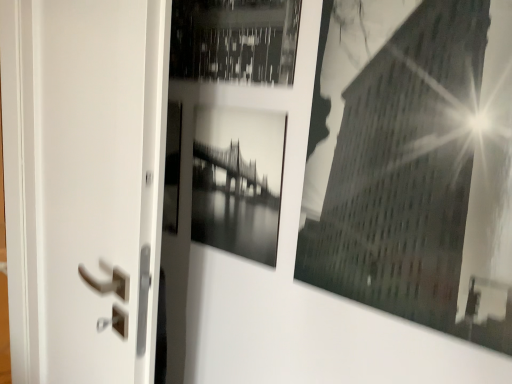
Question: Does black glossy photo frame at center, which appears as the second picture frame when viewed from the right, have a larger size compared to white matte screen door at left?

Choices:
 (A) no
 (B) yes

Answer: (A)

Question: Considering the relative sizes of black glossy photo frame at center, arranged as the first picture frame when viewed from the left, and white matte screen door at left in the image provided, is black glossy photo frame at center, arranged as the first picture frame when viewed from the left, taller than white matte screen door at left?

Choices:
 (A) yes
 (B) no

Answer: (B)

Question: Is black glossy photo frame at center, arranged as the first picture frame when viewed from the left, in front of white matte screen door at left?

Choices:
 (A) yes
 (B) no

Answer: (B)

Question: From a real-world perspective, is black glossy photo frame at center, which appears as the second picture frame when viewed from the right, positioned over white matte screen door at left based on gravity?

Choices:
 (A) yes
 (B) no

Answer: (A)

Question: Considering the relative sizes of black glossy photo frame at center, which appears as the second picture frame when viewed from the right, and white matte screen door at left in the image provided, is black glossy photo frame at center, which appears as the second picture frame when viewed from the right, shorter than white matte screen door at left?

Choices:
 (A) no
 (B) yes

Answer: (B)

Question: Is black glossy photo frame at center, which appears as the second picture frame when viewed from the right, situated inside white matte screen door at left or outside?

Choices:
 (A) outside
 (B) inside

Answer: (A)

Question: Would you say black glossy photo frame at center, which appears as the second picture frame when viewed from the right, is to the left or to the right of white matte screen door at left in the picture?

Choices:
 (A) left
 (B) right

Answer: (B)

Question: Considering the positions of black glossy photo frame at center, which appears as the second picture frame when viewed from the right, and white matte screen door at left in the image, is black glossy photo frame at center, which appears as the second picture frame when viewed from the right, wider or thinner than white matte screen door at left?

Choices:
 (A) wide
 (B) thin

Answer: (B)

Question: From the image's perspective, is black glossy photo frame at center, which appears as the second picture frame when viewed from the right, above or below white matte screen door at left?

Choices:
 (A) below
 (B) above

Answer: (B)

Question: From the image's perspective, is black glossy photo frame at center, arranged as the first picture frame when viewed from the left, positioned above or below black glossy building at upper right, the 1th picture frame viewed from the right?

Choices:
 (A) below
 (B) above

Answer: (A)

Question: Considering the positions of black glossy photo frame at center, arranged as the first picture frame when viewed from the left, and black glossy building at upper right, the 1th picture frame viewed from the right, in the image, is black glossy photo frame at center, arranged as the first picture frame when viewed from the left, bigger or smaller than black glossy building at upper right, the 1th picture frame viewed from the right,?

Choices:
 (A) small
 (B) big

Answer: (A)

Question: Considering the positions of black glossy photo frame at center, which appears as the second picture frame when viewed from the right, and black glossy building at upper right, which ranks as the second picture frame in left-to-right order, in the image, is black glossy photo frame at center, which appears as the second picture frame when viewed from the right, taller or shorter than black glossy building at upper right, which ranks as the second picture frame in left-to-right order,?

Choices:
 (A) tall
 (B) short

Answer: (B)

Question: From a real-world perspective, is black glossy photo frame at center, arranged as the first picture frame when viewed from the left, above or below black glossy building at upper right, the 1th picture frame viewed from the right?

Choices:
 (A) below
 (B) above

Answer: (A)

Question: Considering the positions of white matte screen door at left and black glossy building at upper right, the 1th picture frame viewed from the right, in the image, is white matte screen door at left bigger or smaller than black glossy building at upper right, the 1th picture frame viewed from the right,?

Choices:
 (A) small
 (B) big

Answer: (B)

Question: Would you say white matte screen door at left is inside or outside black glossy building at upper right, which ranks as the second picture frame in left-to-right order?

Choices:
 (A) inside
 (B) outside

Answer: (B)